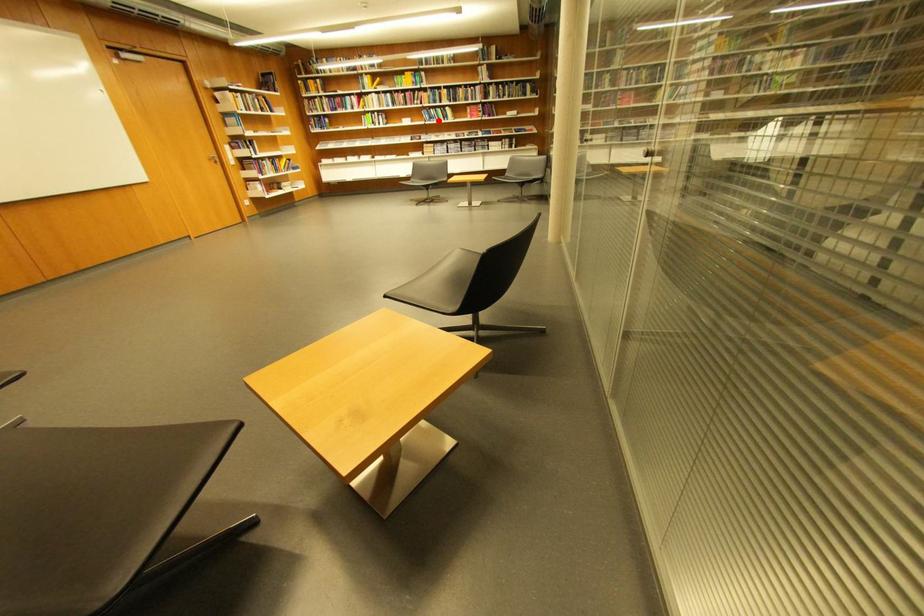
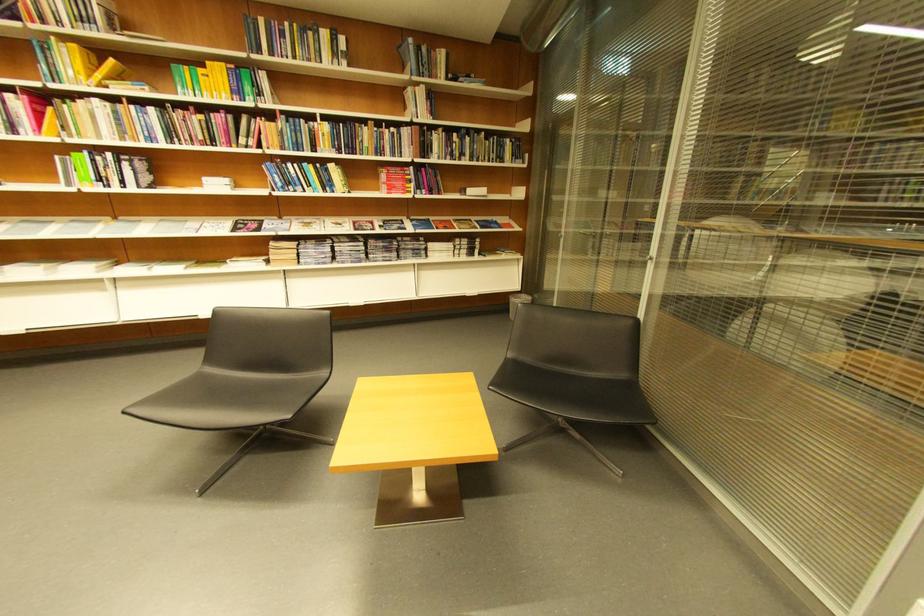
In the second image, find the point that corresponds to the highlighted location in the first image.

(290, 185)